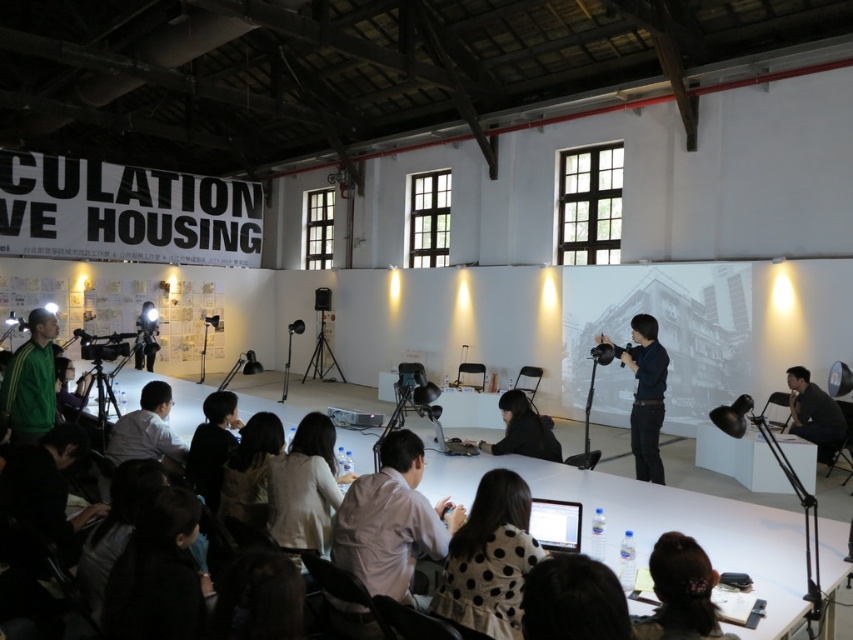
Who is lower down, matte black camera at lower left or matte black projector at center?

matte black projector at center is below.

Can you confirm if matte black camera at lower left is shorter than matte black projector at center?

No.

Does point (74, 396) come closer to viewer compared to point (350, 410)?

Yes, point (74, 396) is closer to viewer.

Find the location of a particular element. The height and width of the screenshot is (640, 853). matte black camera at lower left is located at coordinates (67, 387).

Which is above, polka dot dress at lower center or black fabric at center?

polka dot dress at lower center

Find the location of a particular element. The width and height of the screenshot is (853, 640). polka dot dress at lower center is located at coordinates (573, 600).

This screenshot has width=853, height=640. Find the location of `polka dot dress at lower center`. polka dot dress at lower center is located at coordinates (573, 600).

Find the location of `green adidas jacket at lower left`. green adidas jacket at lower left is located at coordinates (30, 381).

In the scene shown: Which is below, green adidas jacket at lower left or black matte camera at center?

Positioned lower is black matte camera at center.

Where is `green adidas jacket at lower left`? green adidas jacket at lower left is located at coordinates (30, 381).